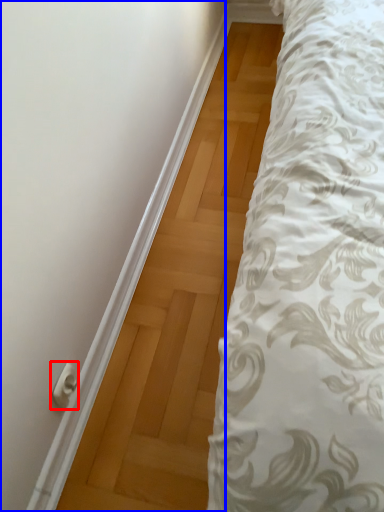
Question: Which object is further to the camera taking this photo, door handle (highlighted by a red box) or door (highlighted by a blue box)?

Choices:
 (A) door handle
 (B) door

Answer: (A)